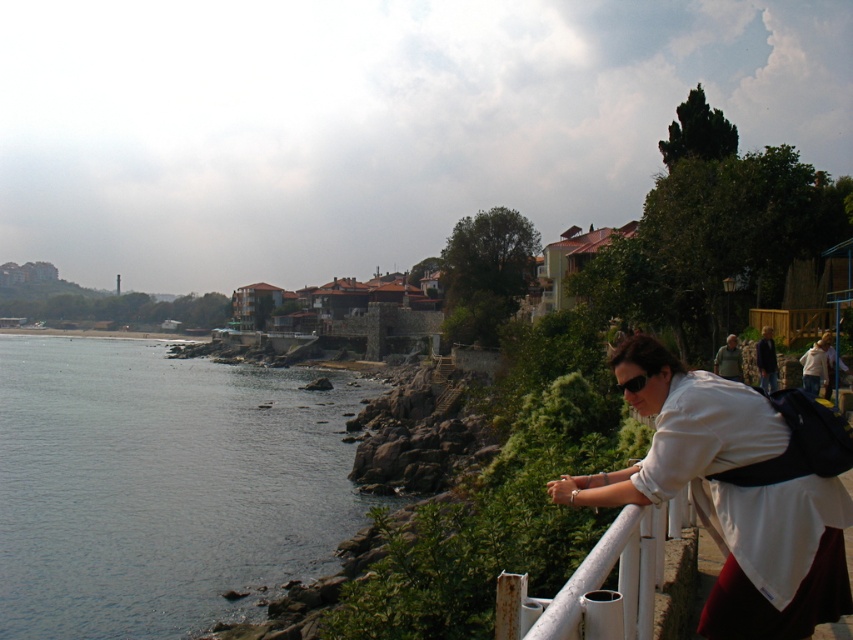
Can you confirm if dark blue water at lower left is positioned below white matte shirt at upper right?

Indeed, dark blue water at lower left is positioned under white matte shirt at upper right.

In the scene shown: Does dark blue water at lower left have a lesser height compared to white matte shirt at upper right?

Yes, dark blue water at lower left is shorter than white matte shirt at upper right.

Is point (285, 577) more distant than point (737, 628)?

Yes, point (285, 577) is behind point (737, 628).

Find the location of a particular element. dark blue water at lower left is located at coordinates (161, 486).

Measure the distance from white matte shirt at upper right to white metallic rail at lower right.

white matte shirt at upper right and white metallic rail at lower right are 30.20 inches apart.

Does point (650, 381) come farther from viewer compared to point (625, 600)?

Yes.

Is point (833, 497) farther from camera compared to point (633, 588)?

That is True.

The height and width of the screenshot is (640, 853). In order to click on white matte shirt at upper right in this screenshot , I will do `click(779, 557)`.

Can you confirm if dark blue water at lower left is bigger than white metallic rail at lower right?

Correct, dark blue water at lower left is larger in size than white metallic rail at lower right.

Which of these two, dark blue water at lower left or white metallic rail at lower right, stands taller?

Standing taller between the two is dark blue water at lower left.

Which is behind, point (115, 364) or point (595, 557)?

Positioned behind is point (115, 364).

Where is `dark blue water at lower left`? The width and height of the screenshot is (853, 640). dark blue water at lower left is located at coordinates (161, 486).